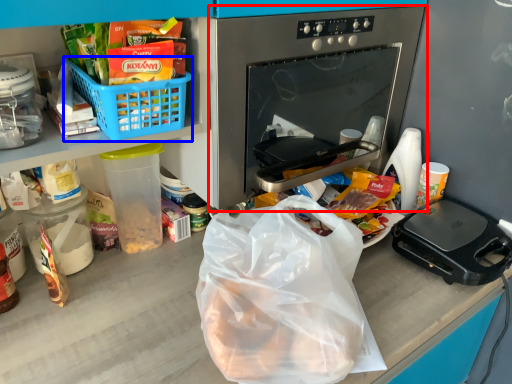
Question: Among these objects, which one is farthest to the camera, oven (highlighted by a red box) or basket (highlighted by a blue box)?

Choices:
 (A) oven
 (B) basket

Answer: (A)